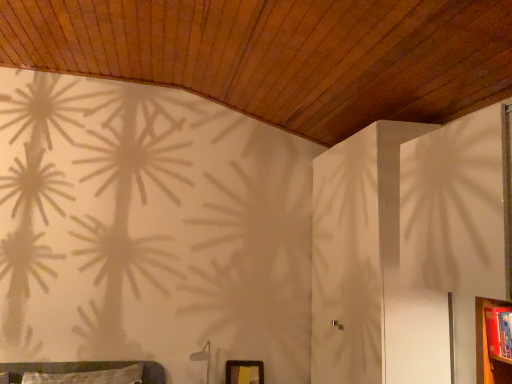
Question: Is wooden dresser at lower right smaller than matte black picture frame at lower center?

Choices:
 (A) no
 (B) yes

Answer: (A)

Question: Does wooden dresser at lower right have a greater height compared to matte black picture frame at lower center?

Choices:
 (A) no
 (B) yes

Answer: (B)

Question: Can you confirm if wooden dresser at lower right is thinner than matte black picture frame at lower center?

Choices:
 (A) yes
 (B) no

Answer: (B)

Question: From the image's perspective, is wooden dresser at lower right located above matte black picture frame at lower center?

Choices:
 (A) no
 (B) yes

Answer: (B)

Question: Is wooden dresser at lower right far away from matte black picture frame at lower center?

Choices:
 (A) no
 (B) yes

Answer: (B)

Question: Is matte black picture frame at lower center inside wooden dresser at lower right?

Choices:
 (A) no
 (B) yes

Answer: (A)

Question: Is matte black picture frame at lower center located outside wooden dresser at lower right?

Choices:
 (A) yes
 (B) no

Answer: (A)

Question: Is matte black picture frame at lower center taller than wooden dresser at lower right?

Choices:
 (A) no
 (B) yes

Answer: (A)

Question: From the image's perspective, would you say matte black picture frame at lower center is positioned over wooden dresser at lower right?

Choices:
 (A) no
 (B) yes

Answer: (A)

Question: Does matte black picture frame at lower center have a greater width compared to wooden dresser at lower right?

Choices:
 (A) yes
 (B) no

Answer: (B)

Question: From a real-world perspective, is matte black picture frame at lower center physically above wooden dresser at lower right?

Choices:
 (A) no
 (B) yes

Answer: (A)

Question: Could you tell me if matte black picture frame at lower center is facing wooden dresser at lower right?

Choices:
 (A) yes
 (B) no

Answer: (B)

Question: Is point (229, 362) closer or farther from the camera than point (478, 355)?

Choices:
 (A) farther
 (B) closer

Answer: (A)